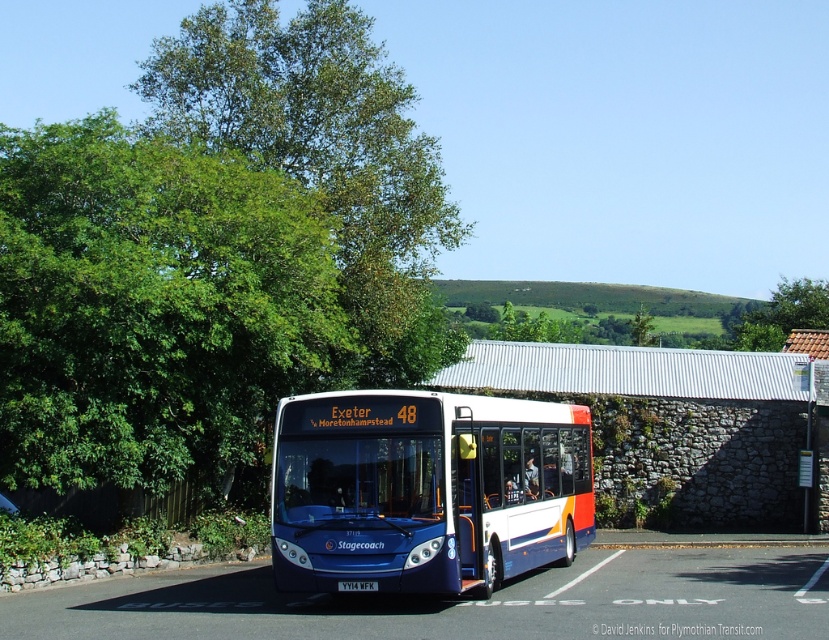
You are waiting at the bus stop and see the green leafy tree at left and the blue metallic bus at center. Which object is positioned more to the left side of the scene?

The green leafy tree at left is positioned more to the left side of the scene compared to the blue metallic bus at center.

You are a bus driver who just arrived at the bus stop. You notice two green leafy trees near the Stagecoach bus. Which tree is closer to the ground, the green leafy tree at left or the green leafy tree at upper left?

The green leafy tree at left is positioned under the green leafy tree at upper left, so the green leafy tree at left is closer to the ground.

You are a passenger waiting at the bus stop. You see the green leafy tree at upper left and the blue metallic bus at center. Which object is closer to you?

The blue metallic bus at center is closer to you because the green leafy tree at upper left is positioned over it, meaning the tree is behind the bus.